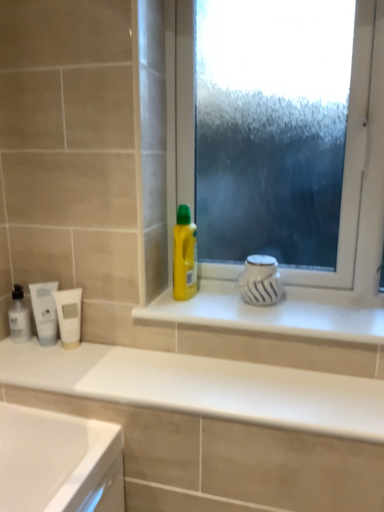
The width and height of the screenshot is (384, 512). In order to click on vacant space situated above white glossy window sill at center (from a real-world perspective) in this screenshot , I will do `click(261, 306)`.